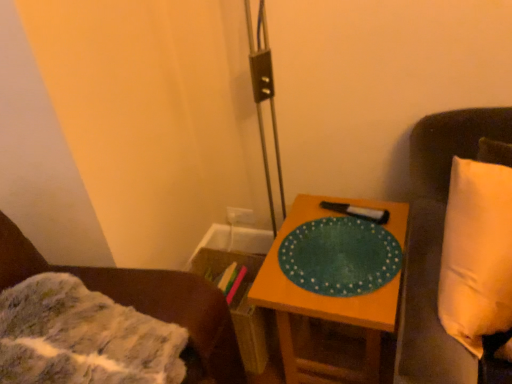
The height and width of the screenshot is (384, 512). What are the coordinates of `vacant area on top of green matte placemat at center (from a real-world perspective)` in the screenshot? It's located at (335, 242).